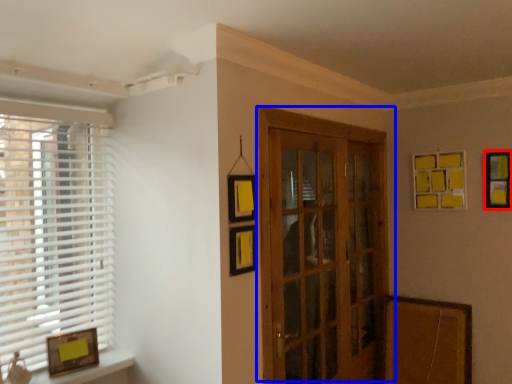
Question: Which object appears closest to the camera in this image, picture frame (highlighted by a red box) or door (highlighted by a blue box)?

Choices:
 (A) picture frame
 (B) door

Answer: (B)